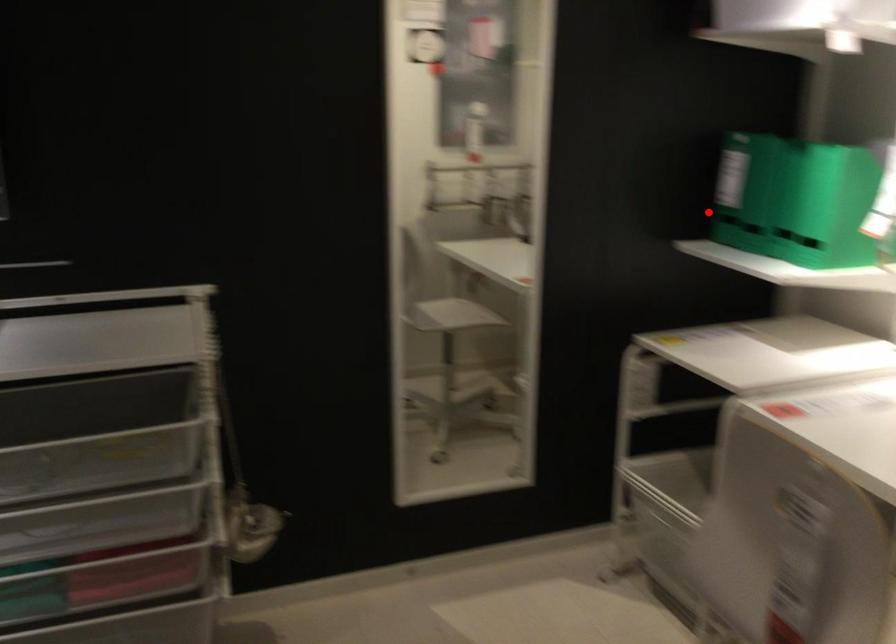
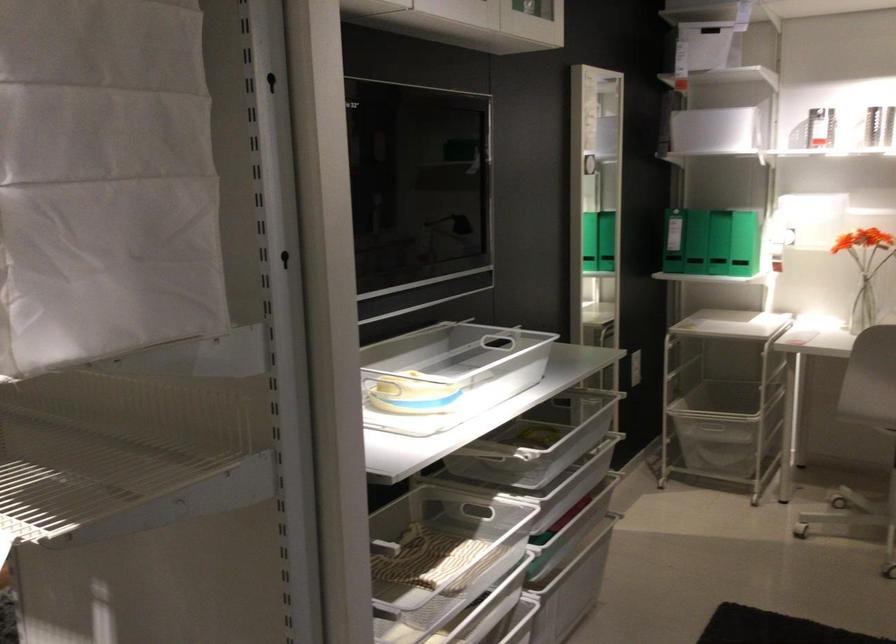
Question: I am providing you with two images of the same scene from different viewpoints. In image1, a red point is highlighted. Considering the same 3D point in image2, which of the following is correct?

Choices:
 (A) It is closer
 (B) It is farther

Answer: (B)